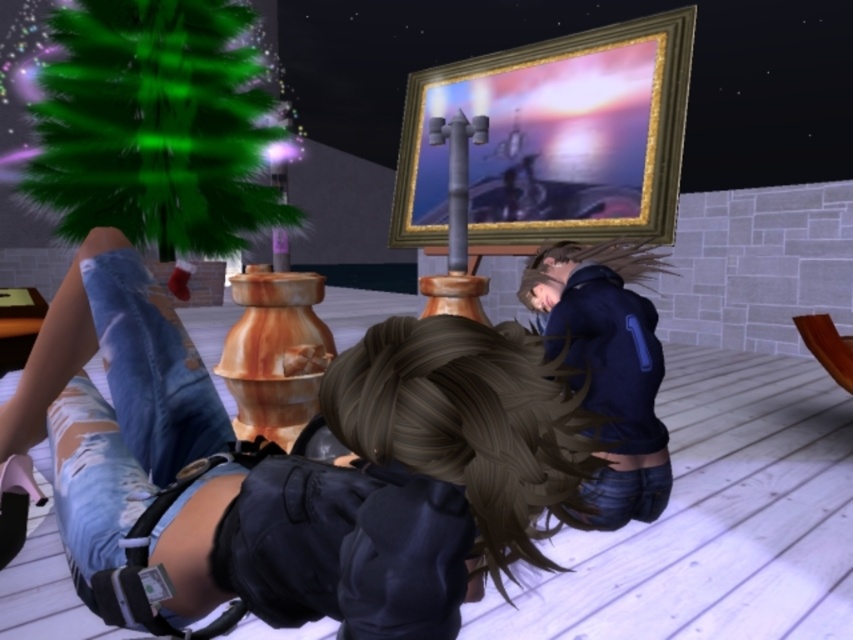
Question: Can you confirm if denim shorts at center is positioned to the left of brown matte hair at center?

Choices:
 (A) no
 (B) yes

Answer: (B)

Question: Is brown wavy hair at center closer to camera compared to brown matte hair at center?

Choices:
 (A) no
 (B) yes

Answer: (B)

Question: Which is farther from the green furry christmas tree at upper left?

Choices:
 (A) denim shorts at center
 (B) dark blue hoodie at lower right

Answer: (A)

Question: Which object is the farthest from the dark blue hoodie at lower right?

Choices:
 (A) brown wavy hair at center
 (B) green furry christmas tree at upper left

Answer: (B)

Question: Is green furry christmas tree at upper left behind dark blue hoodie at lower right?

Choices:
 (A) yes
 (B) no

Answer: (A)

Question: Which point is farther to the camera?

Choices:
 (A) (206, 218)
 (B) (397, 372)

Answer: (A)